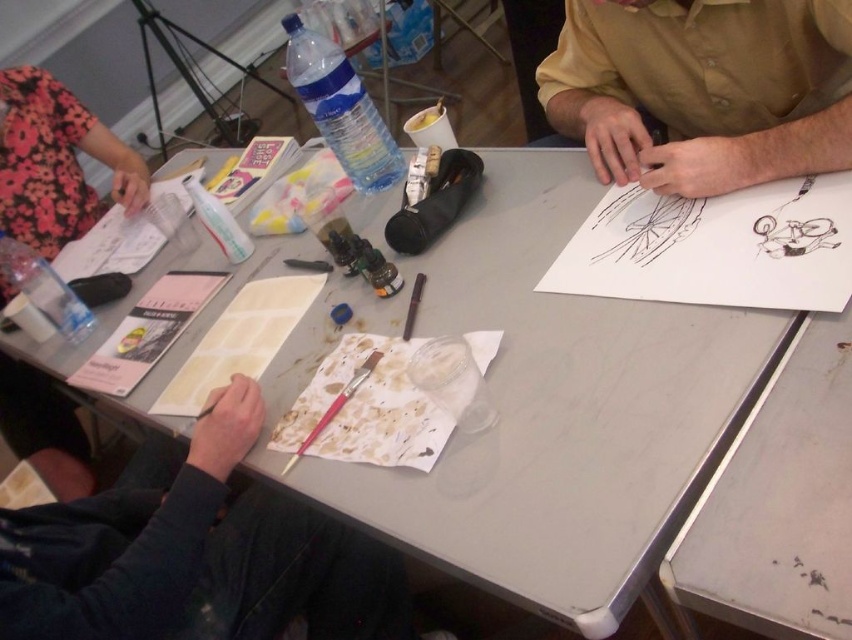
Question: Which object is closer to the camera taking this photo?

Choices:
 (A) matte yellow shirt at upper right
 (B) smooth black paper at lower left

Answer: (B)

Question: Which object appears farthest from the camera in this image?

Choices:
 (A) smooth black paper at lower left
 (B) matte yellow shirt at upper right

Answer: (B)

Question: Can you confirm if smooth black paper at lower left is positioned to the right of matte yellow shirt at upper right?

Choices:
 (A) yes
 (B) no

Answer: (B)

Question: Is smooth black paper at lower left below matte yellow shirt at upper right?

Choices:
 (A) no
 (B) yes

Answer: (B)

Question: Does smooth black paper at lower left appear on the right side of matte yellow shirt at upper right?

Choices:
 (A) no
 (B) yes

Answer: (A)